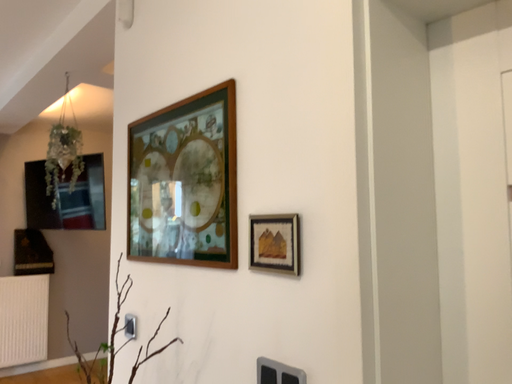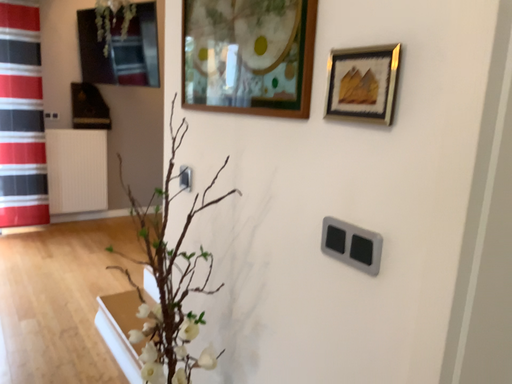
Question: How did the camera likely rotate when shooting the video?

Choices:
 (A) rotated downward
 (B) rotated upward

Answer: (A)